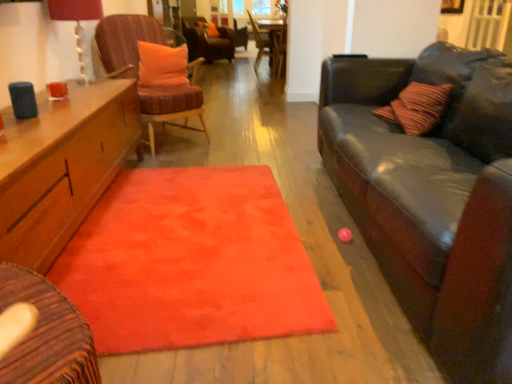
The width and height of the screenshot is (512, 384). I want to click on orange fabric pillow at center, the 2th pillow when ordered from front to back, so click(211, 30).

What is the approximate width of fluffy orange rug at center?

It is 1.11 meters.

At what (x,y) coordinates should I click in order to perform the action: click on wooden table at center. Please return your answer as a coordinate pair (x, y). The image size is (512, 384). Looking at the image, I should click on (272, 46).

Describe the element at coordinates (77, 25) in the screenshot. I see `matte glass lampshade at upper left` at that location.

At what (x,y) coordinates should I click in order to perform the action: click on orange fabric pillow at center, the 2th pillow in the bottom-to-top sequence. Please return your answer as a coordinate pair (x, y). This screenshot has width=512, height=384. Looking at the image, I should click on (211, 30).

Would you say wooden table at center is inside or outside matte glass lampshade at upper left?

wooden table at center is spatially situated outside matte glass lampshade at upper left.

Considering the relative sizes of wooden table at center and matte glass lampshade at upper left in the image provided, is wooden table at center smaller than matte glass lampshade at upper left?

Actually, wooden table at center might be larger than matte glass lampshade at upper left.

From the image's perspective, would you say wooden table at center is shown under matte glass lampshade at upper left?

No, from the image's perspective, wooden table at center is not beneath matte glass lampshade at upper left.

Is wooden chair at center, placed as the second chair when sorted from front to back, situated inside wooden table at center or outside?

wooden chair at center, placed as the second chair when sorted from front to back, lies within the bounds of wooden table at center.

Can you confirm if wooden chair at center, the 2th chair in the back-to-front sequence, is taller than wooden table at center?

Indeed, wooden chair at center, the 2th chair in the back-to-front sequence, has a greater height compared to wooden table at center.

From a real-world perspective, is wooden chair at center, the second chair positioned from the top, under wooden table at center?

Actually, wooden chair at center, the second chair positioned from the top, is physically above wooden table at center in the real world.

Does wooden chair at center, the 2th chair in the back-to-front sequence, have a larger size compared to wooden table at center?

Actually, wooden chair at center, the 2th chair in the back-to-front sequence, might be smaller than wooden table at center.

Is orange fabric pillow at upper center, which is the 2th pillow in top-to-bottom order, not near fluffy orange rug at center?

Yes, orange fabric pillow at upper center, which is the 2th pillow in top-to-bottom order, is far from fluffy orange rug at center.

Considering the relative positions of orange fabric pillow at upper center, the 2th pillow when ordered from back to front, and fluffy orange rug at center in the image provided, is orange fabric pillow at upper center, the 2th pillow when ordered from back to front, in front of fluffy orange rug at center?

No, it is behind fluffy orange rug at center.

From the image's perspective, who appears lower, orange fabric pillow at upper center, placed as the 1th pillow when sorted from bottom to top, or fluffy orange rug at center?

fluffy orange rug at center, from the image's perspective.

In the scene shown: Can you confirm if orange fabric pillow at upper center, the 2th pillow when ordered from back to front, is taller than fluffy orange rug at center?

Yes.

In the scene shown: Is wooden table at center located within matte glass lampshade at upper left?

No.

Between matte glass lampshade at upper left and wooden table at center, which one has smaller size?

matte glass lampshade at upper left is smaller.

How far apart are matte glass lampshade at upper left and wooden table at center?

matte glass lampshade at upper left and wooden table at center are 3.77 meters apart.

From a real-world perspective, is matte glass lampshade at upper left physically above orange fabric pillow at center, the first pillow in the back-to-front sequence?

Correct, in the physical world, matte glass lampshade at upper left is higher than orange fabric pillow at center, the first pillow in the back-to-front sequence.

Between point (93, 0) and point (208, 32), which one is positioned behind?

Point (208, 32)

From the image's perspective, which one is positioned lower, matte glass lampshade at upper left or orange fabric pillow at center, which ranks as the 1th pillow in top-to-bottom order?

matte glass lampshade at upper left appears lower in the image.

Find the location of a particular element. The height and width of the screenshot is (384, 512). mat in front of the velvet orange chair at left, arranged as the 3th chair when viewed from the top is located at coordinates (191, 262).

Would you say fluffy orange rug at center is inside or outside velvet orange chair at left, which is the 3th chair from back to front?

fluffy orange rug at center is not inside velvet orange chair at left, which is the 3th chair from back to front, it's outside.

Which is behind, point (195, 324) or point (132, 77)?

The point (132, 77) is more distant.

Are orange fabric pillow at upper center, which is the 1th pillow in front-to-back order, and matte glass lampshade at upper left located far from each other?

No, orange fabric pillow at upper center, which is the 1th pillow in front-to-back order, is not far away from matte glass lampshade at upper left.

Is orange fabric pillow at upper center, which is the 1th pillow in front-to-back order, at the left side of matte glass lampshade at upper left?

No.

Does orange fabric pillow at upper center, the 2th pillow when ordered from back to front, have a smaller size compared to matte glass lampshade at upper left?

Correct, orange fabric pillow at upper center, the 2th pillow when ordered from back to front, occupies less space than matte glass lampshade at upper left.

Does orange fabric pillow at upper center, placed as the 1th pillow when sorted from bottom to top, have a greater width compared to matte glass lampshade at upper left?

No.

The image size is (512, 384). What are the coordinates of `table on the right of matte glass lampshade at upper left` in the screenshot? It's located at coord(272,46).

Locate an element on the screen. This screenshot has width=512, height=384. table below the wooden chair at center, placed as the second chair when sorted from front to back (from the image's perspective) is located at coordinates (272, 46).

Looking at the image, which one is located closer to velvet orange chair at center, the first chair positioned from the back, matte glass lampshade at upper left or wooden table at center?

wooden table at center.

Based on the photo, considering their positions, is orange fabric pillow at center, the 2th pillow when ordered from front to back, positioned further to wooden chair at center, the 2th chair positioned from the bottom, than velvet brown armchair at center?

velvet brown armchair at center.

Based on their spatial positions, is orange fabric pillow at upper center, placed as the 1th pillow when sorted from bottom to top, or wooden chair at center, the 2th chair in the back-to-front sequence, closer to wooden table at center?

wooden chair at center, the 2th chair in the back-to-front sequence, lies closer to wooden table at center than the other object.

When comparing their distances from orange fabric pillow at center, the 2th pillow in the bottom-to-top sequence, does orange fabric pillow at upper center, which is the 1th pillow in front-to-back order, or velvet orange chair at left, arranged as the 3th chair when viewed from the top, seem closer?

Among the two, orange fabric pillow at upper center, which is the 1th pillow in front-to-back order, is located nearer to orange fabric pillow at center, the 2th pillow in the bottom-to-top sequence.

Estimate the real-world distances between objects in this image. Which object is closer to orange fabric pillow at center, the first pillow in the back-to-front sequence, fluffy orange rug at center or orange fabric pillow at upper center, which is the 2th pillow in top-to-bottom order?

Among the two, orange fabric pillow at upper center, which is the 2th pillow in top-to-bottom order, is located nearer to orange fabric pillow at center, the first pillow in the back-to-front sequence.

Which object lies nearer to the anchor point velvet orange chair at center, arranged as the 1th chair when viewed from the top, orange fabric pillow at center, the first pillow in the back-to-front sequence, or velvet brown armchair at center?

orange fabric pillow at center, the first pillow in the back-to-front sequence, is closer to velvet orange chair at center, arranged as the 1th chair when viewed from the top.

Looking at the image, which one is located closer to matte glass lampshade at upper left, velvet orange chair at left, which is the first chair in front-to-back order, or orange fabric pillow at center, which ranks as the 1th pillow in top-to-bottom order?

velvet orange chair at left, which is the first chair in front-to-back order, lies closer to matte glass lampshade at upper left than the other object.

Estimate the real-world distances between objects in this image. Which object is further from wooden chair at center, the 2th chair positioned from the bottom, orange fabric pillow at center, the 2th pillow in the bottom-to-top sequence, or matte glass lampshade at upper left?

matte glass lampshade at upper left is positioned further to the anchor wooden chair at center, the 2th chair positioned from the bottom.

At what (x,y) coordinates should I click in order to perform the action: click on chair between velvet orange chair at left, arranged as the 3th chair when viewed from the top, and velvet orange chair at center, which is the 3th chair from front to back, in the front-back direction. Please return your answer as a coordinate pair (x, y). This screenshot has height=384, width=512. Looking at the image, I should click on (261, 42).

This screenshot has width=512, height=384. I want to click on armchair between velvet orange chair at left, which is the 3th chair from back to front, and wooden chair at center, the 2th chair positioned from the bottom, in the front-back direction, so click(x=278, y=50).

What are the coordinates of `armchair between matte glass lampshade at upper left and wooden chair at center, the second chair positioned from the top, from front to back` in the screenshot? It's located at (278, 50).

You are a GUI agent. You are given a task and a screenshot of the screen. Output one action in this format:
    pyautogui.click(x=<x>, y=<y>)
    Task: Click on the armchair between fluffy orange rug at center and orange fabric pillow at center, the 2th pillow in the bottom-to-top sequence, in the front-back direction
    The image size is (512, 384).
    Given the screenshot: What is the action you would take?
    pyautogui.click(x=278, y=50)